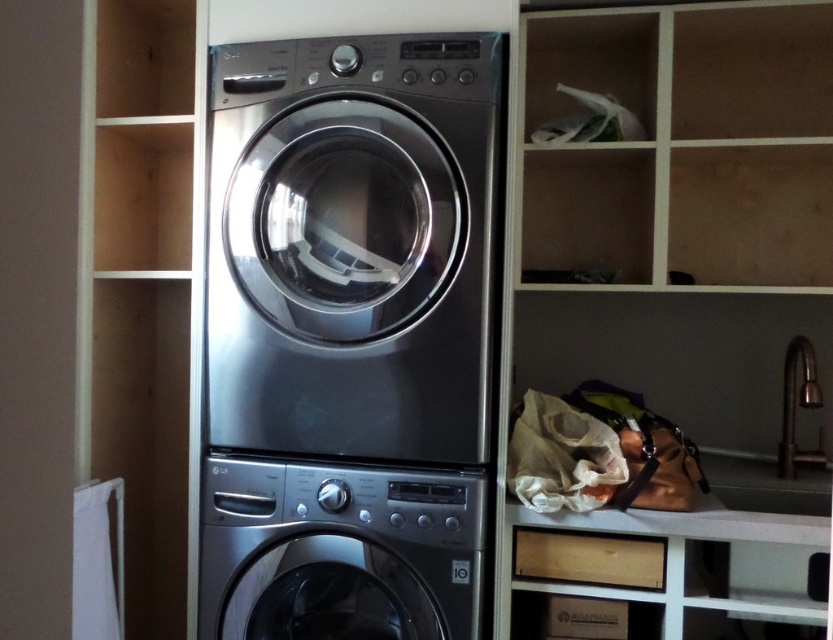
You are trying to determine which washing machine is taller in the laundry room. You see a stainless steel washing machine at center and a satin silver washing machine at center. Which one is taller?

The stainless steel washing machine at center is taller than the satin silver washing machine at center.

You are moving into a new apartment and need to fit both the stainless steel washing machine at center and the satin silver washing machine at center into a space that is 1.2 meters wide. Based on their widths, can both machines fit side by side?

The stainless steel washing machine at center is wider than the satin silver washing machine at center. If their combined widths exceed 1.2 meters, they might not fit. However, without exact measurements, it is impossible to determine definitively.